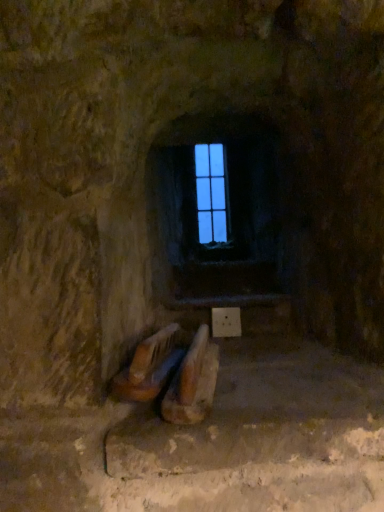
Question: Would you say clear glass window at center is to the left or to the right of wooden crate at lower center in the picture?

Choices:
 (A) left
 (B) right

Answer: (B)

Question: Based on their sizes in the image, would you say clear glass window at center is bigger or smaller than wooden crate at lower center?

Choices:
 (A) big
 (B) small

Answer: (B)

Question: From the image's perspective, relative to wooden crate at lower center, is clear glass window at center above or below?

Choices:
 (A) above
 (B) below

Answer: (A)

Question: Is point (162, 332) positioned closer to the camera than point (205, 145)?

Choices:
 (A) farther
 (B) closer

Answer: (B)

Question: Considering the positions of wooden crate at lower center and clear glass window at center in the image, is wooden crate at lower center taller or shorter than clear glass window at center?

Choices:
 (A) short
 (B) tall

Answer: (A)

Question: Choose the correct answer: Is wooden crate at lower center inside clear glass window at center or outside it?

Choices:
 (A) outside
 (B) inside

Answer: (A)

Question: Considering the positions of wooden crate at lower center and clear glass window at center in the image, is wooden crate at lower center wider or thinner than clear glass window at center?

Choices:
 (A) thin
 (B) wide

Answer: (B)